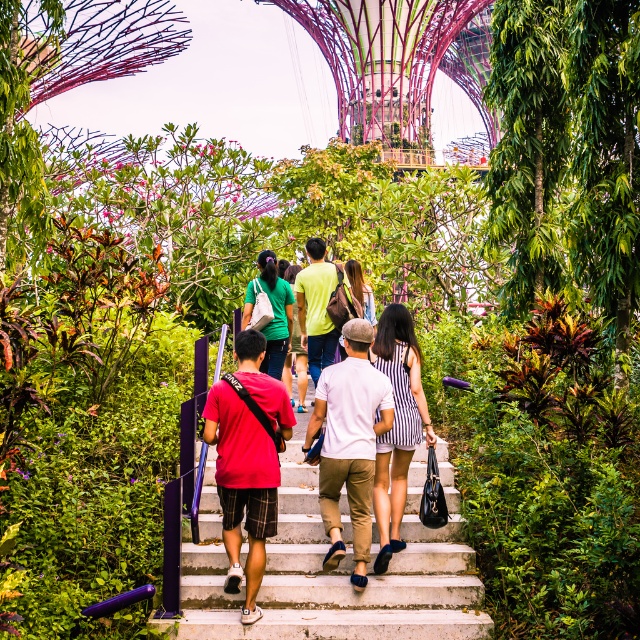
Question: Considering the real-world distances, which object is closest to the denim jacket at center?

Choices:
 (A) concrete stairs at center
 (B) matte green shirt at center
 (C) matte red t-shirt at center

Answer: (B)

Question: Is matte green shirt at center wider than denim jacket at center?

Choices:
 (A) no
 (B) yes

Answer: (B)

Question: Which of the following is the farthest from the observer?

Choices:
 (A) striped fabric dress at center
 (B) concrete stairs at center
 (C) matte red t-shirt at center
 (D) matte green shirt at center

Answer: (D)

Question: From the image, what is the correct spatial relationship of concrete stairs at center in relation to matte red t-shirt at center?

Choices:
 (A) right
 (B) left

Answer: (A)

Question: Which is nearer to the white cotton shirt at center?

Choices:
 (A) striped fabric dress at center
 (B) concrete stairs at center

Answer: (A)

Question: Is white cotton shirt at center to the left of denim jacket at center from the viewer's perspective?

Choices:
 (A) yes
 (B) no

Answer: (A)